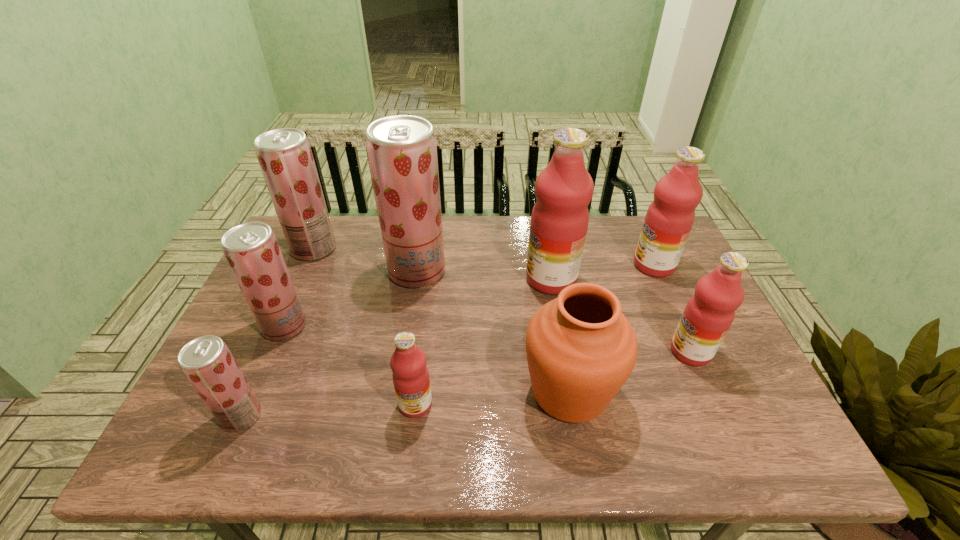
Identify the location of the rightmost strawberry fruit juice. Image resolution: width=960 pixels, height=540 pixels. (402, 152).

Image resolution: width=960 pixels, height=540 pixels. Find the location of `the sixth fruit juice from left to right`. the sixth fruit juice from left to right is located at coordinates click(x=564, y=188).

You are a GUI agent. You are given a task and a screenshot of the screen. Output one action in this format:
    pyautogui.click(x=<x>, y=<y>)
    Task: Click on the biggest pink fruit juice
    The width and height of the screenshot is (960, 540).
    Given the screenshot: What is the action you would take?
    pyautogui.click(x=564, y=188)

Locate an element on the screen. the second biggest strawberry fruit juice is located at coordinates (285, 157).

In order to click on the second biggest pink fruit juice in this screenshot , I will do `click(669, 219)`.

This screenshot has width=960, height=540. What are the coordinates of `the second smallest strawberry fruit juice` in the screenshot? It's located at (251, 249).

You are a GUI agent. You are given a task and a screenshot of the screen. Output one action in this format:
    pyautogui.click(x=<x>, y=<y>)
    Task: Click on the second smallest pink fruit juice
    
    Given the screenshot: What is the action you would take?
    pyautogui.click(x=708, y=315)

At what (x,y) coordinates should I click in order to perform the action: click on brown urn. Please return your answer as a coordinate pair (x, y). This screenshot has height=540, width=960. Looking at the image, I should click on (581, 349).

Where is `the nearest strawberry fruit juice`? the nearest strawberry fruit juice is located at coordinates (206, 361).

Find the location of a particular element. The width and height of the screenshot is (960, 540). the leftmost pink fruit juice is located at coordinates (410, 375).